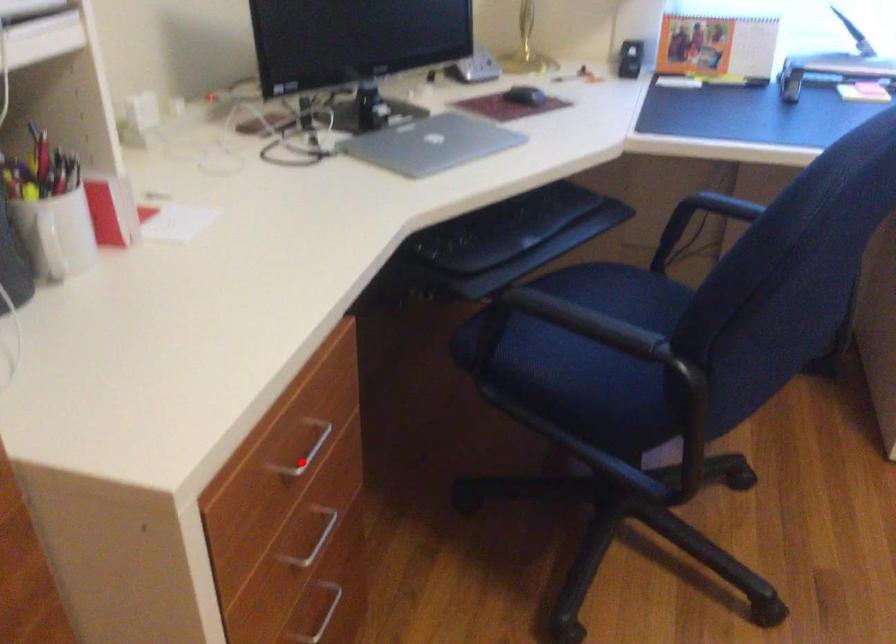
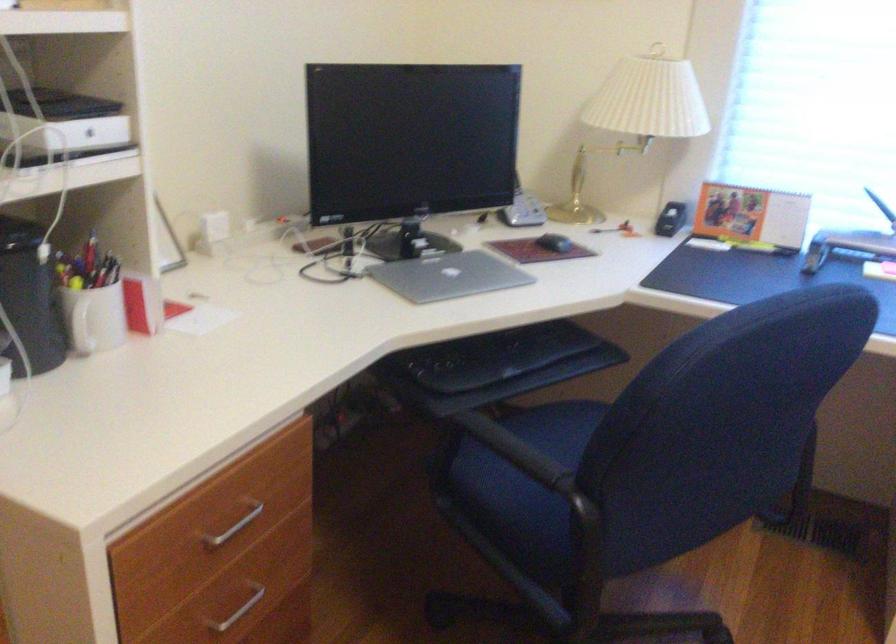
Question: I am providing you with two images of the same scene from different viewpoints. A red point is shown in image1. For the corresponding object point in image2, is it positioned nearer or farther from the camera?

Choices:
 (A) Nearer
 (B) Farther

Answer: (B)